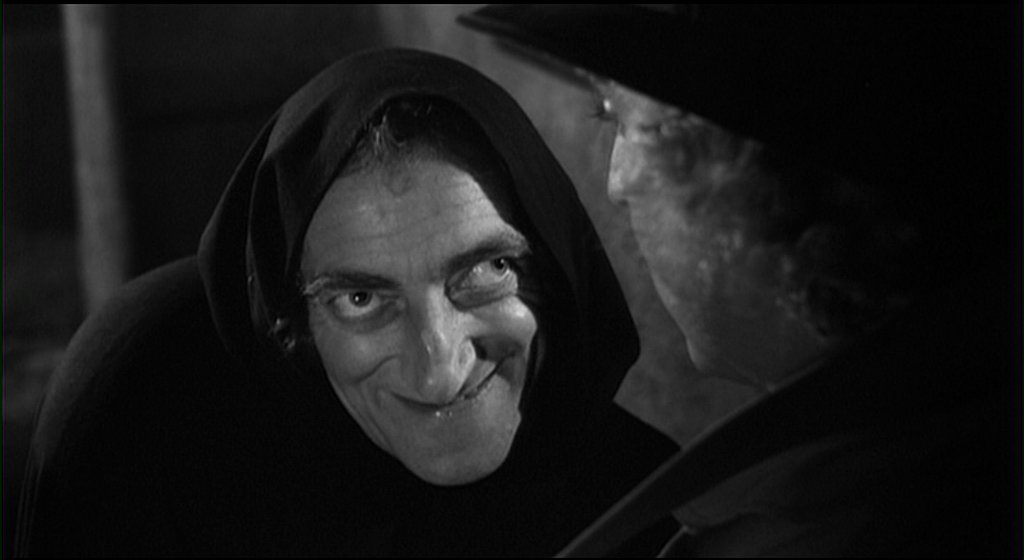
Image resolution: width=1024 pixels, height=560 pixels. Find the location of `hood`. hood is located at coordinates (245, 222).